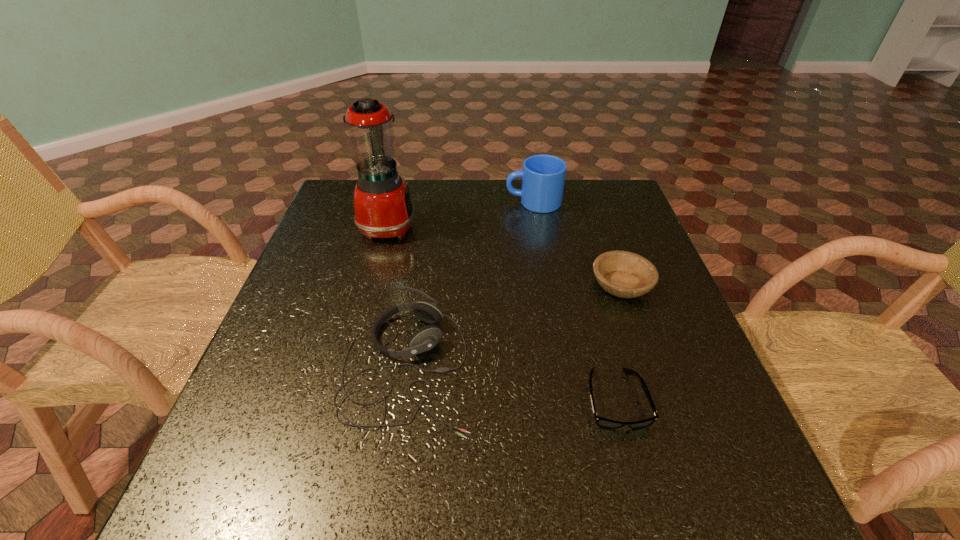
The image size is (960, 540). Identify the location of free point located on the outer surface of the headset. (532, 366).

Identify the location of free space located on the front of the second shortest object. (676, 442).

Where is `food processor that is at the far edge`? food processor that is at the far edge is located at coordinates (383, 208).

Where is `mug at the far edge`? This screenshot has width=960, height=540. mug at the far edge is located at coordinates (543, 176).

Identify the location of object situated at the left edge. Image resolution: width=960 pixels, height=540 pixels. (383, 208).

The image size is (960, 540). Find the location of `bowl positioned at the right edge`. bowl positioned at the right edge is located at coordinates (624, 274).

At what (x,y) coordinates should I click in order to perform the action: click on sunglasses present at the right edge. Please return your answer as a coordinate pair (x, y). This screenshot has height=540, width=960. Looking at the image, I should click on (602, 422).

The image size is (960, 540). In order to click on object that is positioned at the far left corner in this screenshot , I will do `click(383, 208)`.

Image resolution: width=960 pixels, height=540 pixels. In order to click on vacant space at the far edge of the desktop in this screenshot , I will do `click(413, 190)`.

Locate an element on the screen. This screenshot has width=960, height=540. vacant space at the near edge of the desktop is located at coordinates (440, 465).